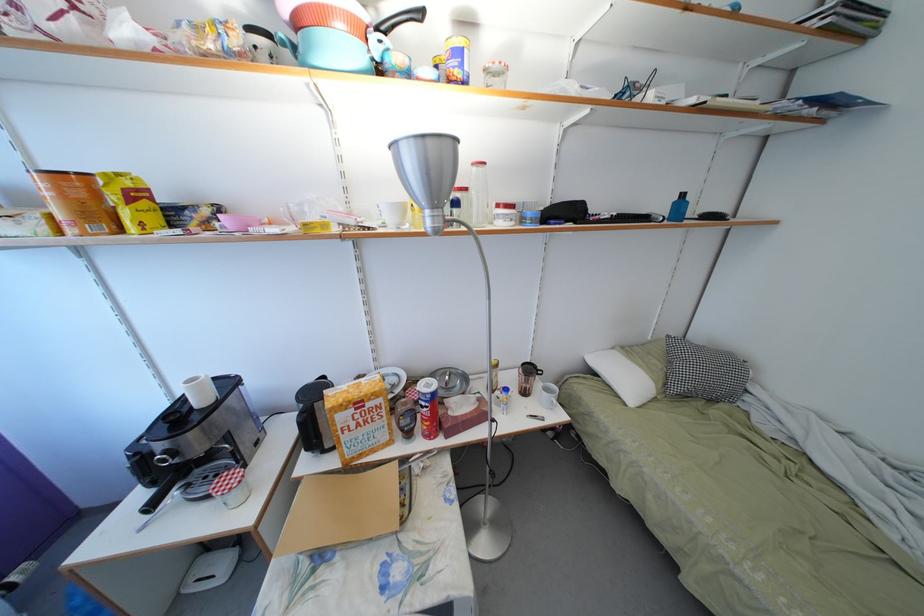
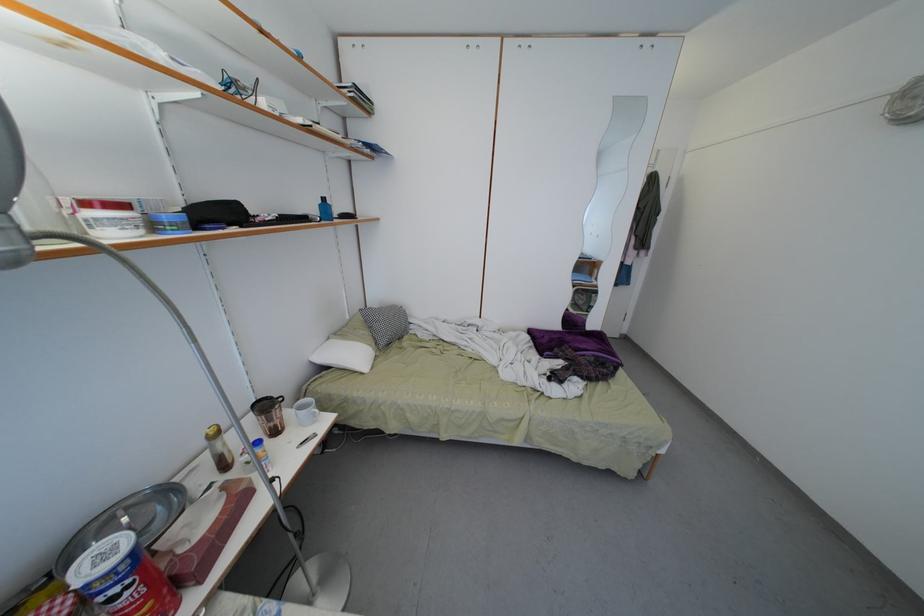
Locate, in the second image, the point that corresponds to (x=675, y=368) in the first image.

(375, 333)